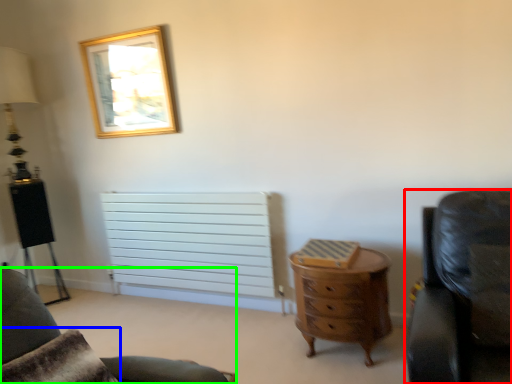
Question: Based on their relative distances, which object is farther from chair (highlighted by a red box)? Choose from pillow (highlighted by a blue box) and chair (highlighted by a green box).

Choices:
 (A) pillow
 (B) chair

Answer: (A)